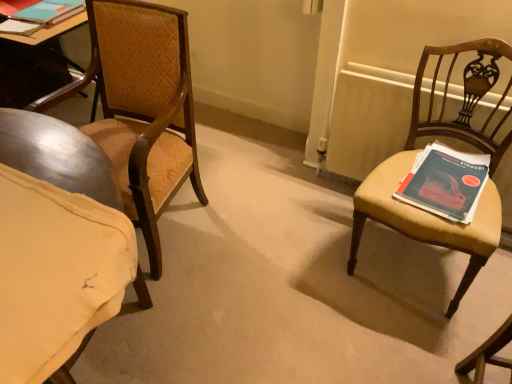
This screenshot has width=512, height=384. In order to click on vacant region above wooden radiator at right (from a real-world perspective) in this screenshot , I will do `click(414, 88)`.